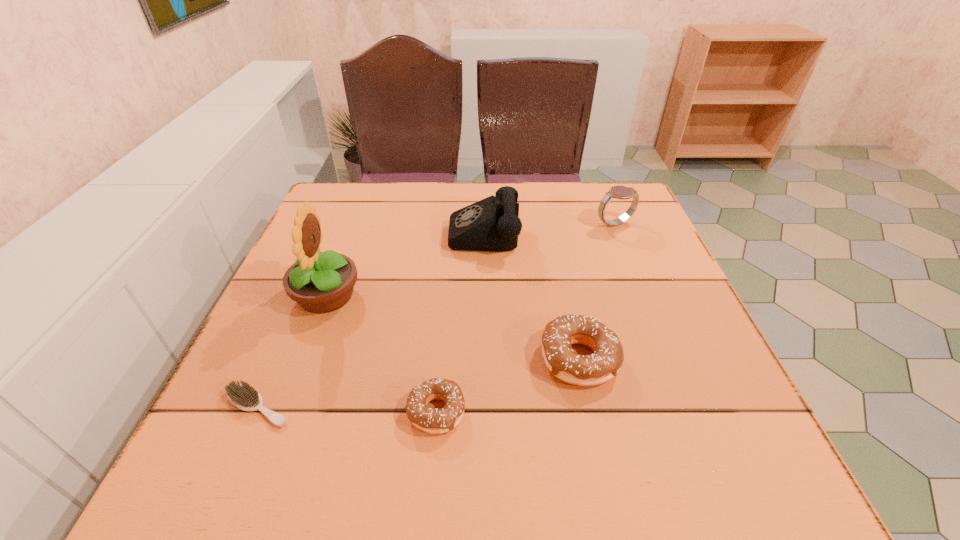
Please show where to add a doughnut on the right while keeping spacing even. Please provide its 2D coordinates. Your answer should be formatted as a tuple, i.e. [(x, y)], where the tuple contains the x and y coordinates of a point satisfying the conditions above.

[(696, 316)]